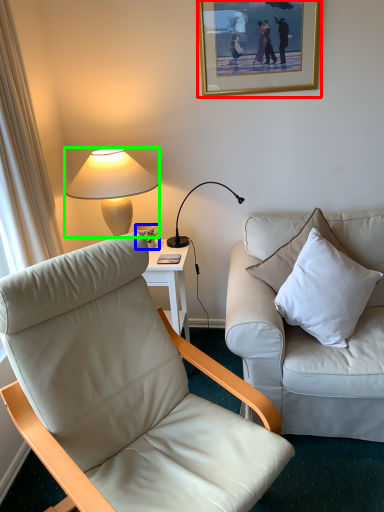
Question: Which is farther away from picture frame (highlighted by a red box)? coffee cup (highlighted by a blue box) or lamp (highlighted by a green box)?

Choices:
 (A) coffee cup
 (B) lamp

Answer: (A)